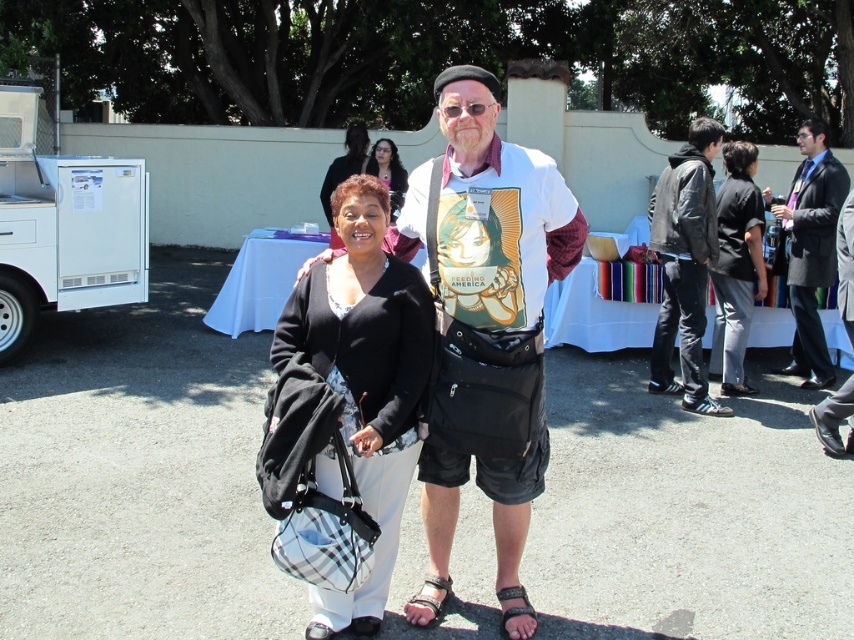
Does white plastic food truck at left appear over black leather jacket at right?

Yes.

Between point (135, 221) and point (697, 234), which one is positioned behind?

Point (135, 221)

Between point (69, 260) and point (685, 198), which one is positioned in front?

Point (685, 198) is more forward.

Find the location of a particular element. The width and height of the screenshot is (854, 640). white plastic food truck at left is located at coordinates (63, 225).

Can you confirm if black fabric purse at center is positioned above dark gray suit at right?

No, black fabric purse at center is not above dark gray suit at right.

Is black fabric purse at center shorter than dark gray suit at right?

Yes.

Is point (344, 374) closer to viewer compared to point (805, 298)?

Yes, point (344, 374) is in front of point (805, 298).

Locate an element on the screen. The image size is (854, 640). black fabric purse at center is located at coordinates (364, 378).

Who is lower down, black leather jacket at center or matte black shirt at center?

black leather jacket at center

You are a GUI agent. You are given a task and a screenshot of the screen. Output one action in this format:
    pyautogui.click(x=<x>, y=<y>)
    Task: Click on the black leather jacket at center
    The image size is (854, 640).
    Given the screenshot: What is the action you would take?
    pyautogui.click(x=809, y=243)

Find the location of a particular element. black leather jacket at center is located at coordinates (809, 243).